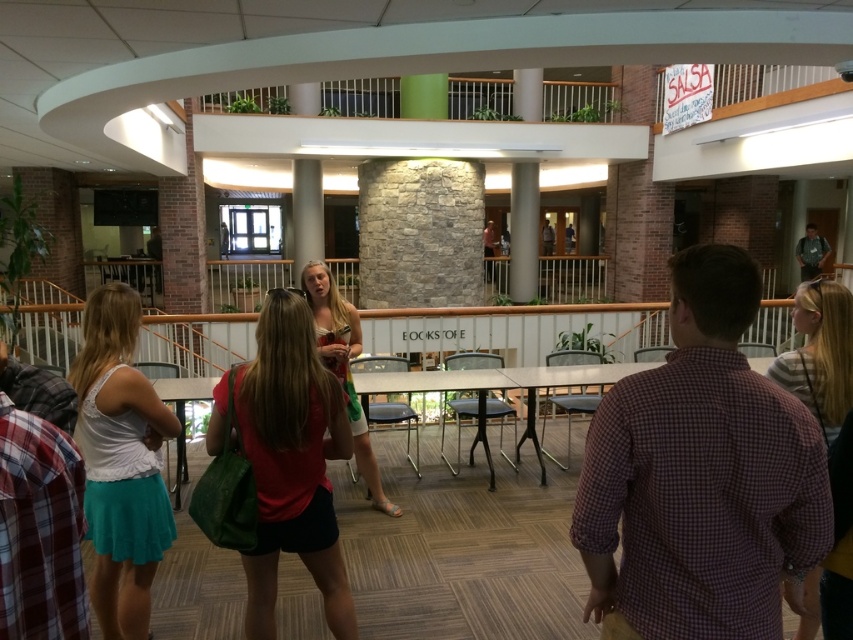
Does plaid cotton shirt at upper right have a greater width compared to matte white tank top at left?

Indeed, plaid cotton shirt at upper right has a greater width compared to matte white tank top at left.

Is point (669, 454) more distant than point (126, 499)?

No, it is in front of (126, 499).

I want to click on plaid cotton shirt at upper right, so click(x=701, y=476).

Locate an element on the screen. This screenshot has width=853, height=640. plaid cotton shirt at upper right is located at coordinates 701,476.

Can you confirm if matte green bag at center is positioned above matte white tank top at left?

Indeed, matte green bag at center is positioned over matte white tank top at left.

Locate an element on the screen. matte green bag at center is located at coordinates (291, 461).

Locate an element on the screen. This screenshot has height=640, width=853. matte green bag at center is located at coordinates (291, 461).

Does plaid cotton shirt at upper right appear on the right side of matte green bag at center?

Correct, you'll find plaid cotton shirt at upper right to the right of matte green bag at center.

Looking at this image, measure the distance between plaid cotton shirt at upper right and camera.

A distance of 1.49 meters exists between plaid cotton shirt at upper right and camera.

Who is more distant from viewer, (683, 472) or (329, 396)?

Point (329, 396)

You are a GUI agent. You are given a task and a screenshot of the screen. Output one action in this format:
    pyautogui.click(x=<x>, y=<y>)
    Task: Click on the plaid cotton shirt at upper right
    
    Given the screenshot: What is the action you would take?
    pyautogui.click(x=701, y=476)